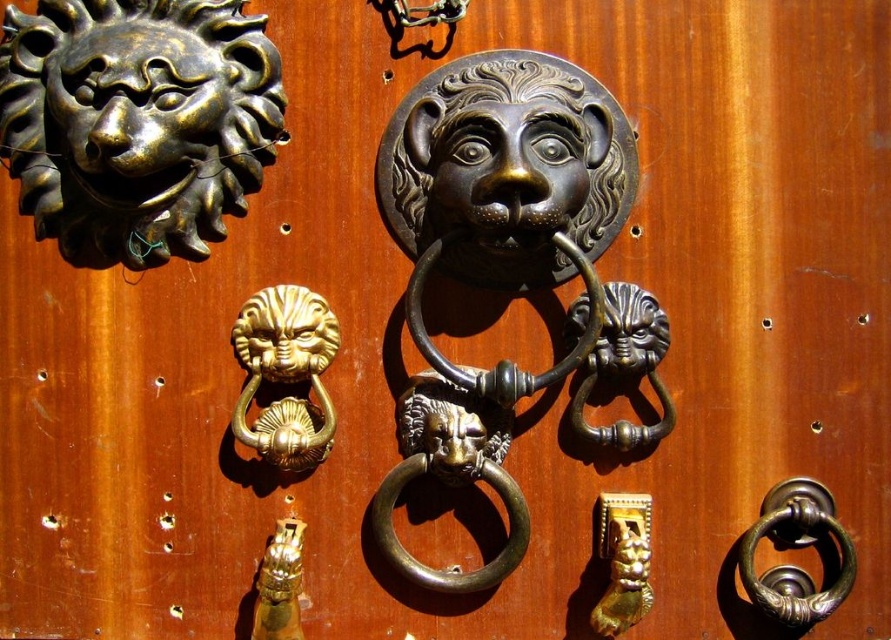
You are standing in front of a wooden door with two lion head knockers. The gold polished lion head at center and the polished brass lion head at center. Which one is located to the left?

The gold polished lion head at center is positioned on the left side of the polished brass lion head at center.

You are a guest at a historic mansion and need to locate the main entrance door handle. You see the brass ring handle at center and the gold polished lion head at lower center. Which one is positioned to the right of the other?

The brass ring handle at center is positioned on the right side of gold polished lion head at lower center.